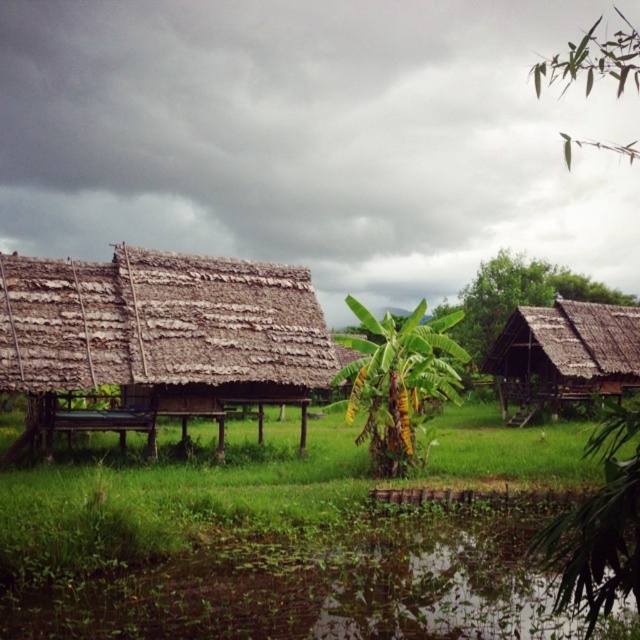
You are standing at the center of the scene and want to cross to the other side. There is a green muddy water at lower center. Is there a safe path around it to avoid stepping into the water?

The green muddy water at lower center is located at point (x=317, y=593). Since the huts are elevated on stilts over the grassy area with patches of water, you can walk around the green muddy water at lower center by following the elevated huts or the dry grassy patches to reach the other side safely.